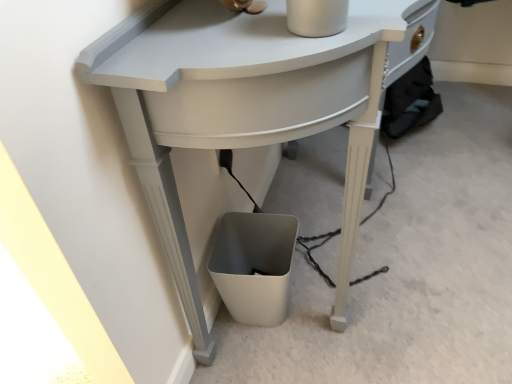
This screenshot has height=384, width=512. I want to click on empty space that is to the right of matte white table at center, so click(x=453, y=214).